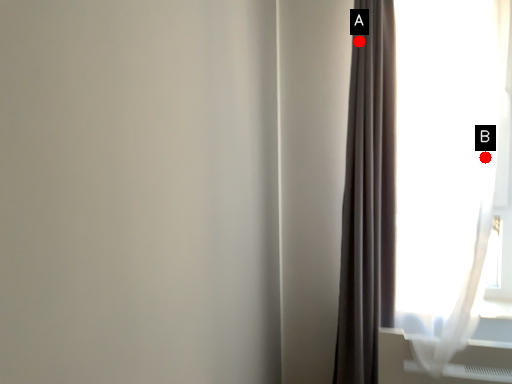
Question: Two points are circled on the image, labeled by A and B beside each circle. Which point is closer to the camera taking this photo?

Choices:
 (A) A is closer
 (B) B is closer

Answer: (B)